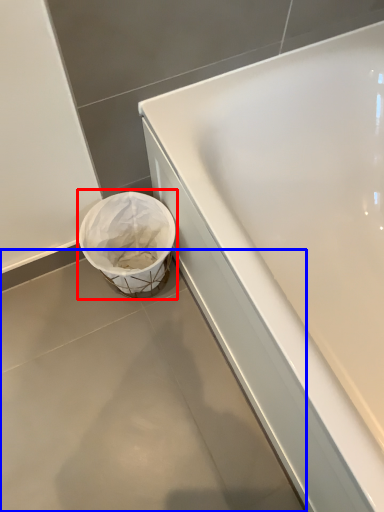
Question: Which object is further to the camera taking this photo, waste container (highlighted by a red box) or concrete (highlighted by a blue box)?

Choices:
 (A) waste container
 (B) concrete

Answer: (A)